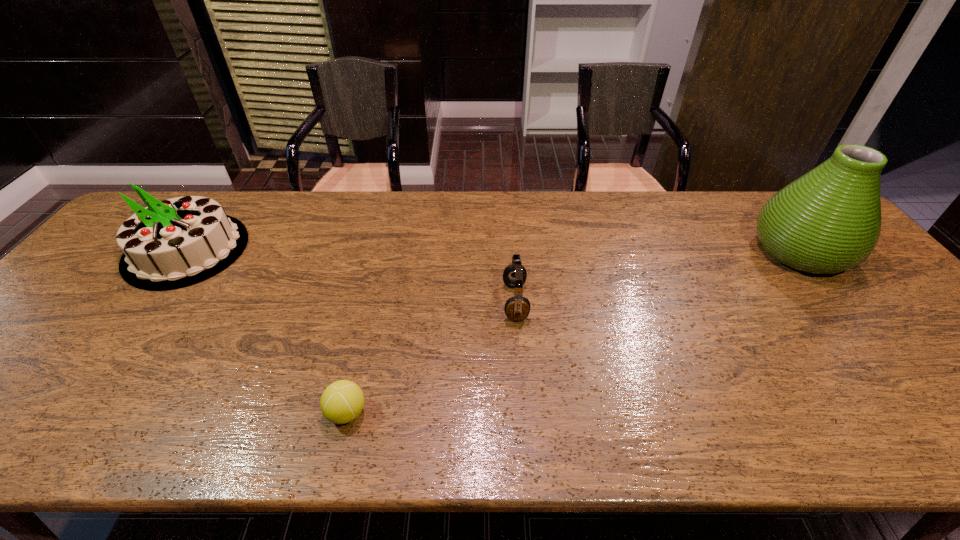
Locate an element on the screen. The width and height of the screenshot is (960, 540). the rightmost object is located at coordinates (827, 221).

I want to click on the tallest object, so click(x=827, y=221).

Find the location of a particular element. This screenshot has height=540, width=960. birthday cake is located at coordinates [x=175, y=243].

Where is `the leftmost object`? This screenshot has height=540, width=960. the leftmost object is located at coordinates (175, 243).

At what (x,y) coordinates should I click in order to perform the action: click on the third tallest object. Please return your answer as a coordinate pair (x, y). Image resolution: width=960 pixels, height=540 pixels. Looking at the image, I should click on (517, 308).

At what (x,y) coordinates should I click in order to perform the action: click on headset. Please return your answer as a coordinate pair (x, y). The image size is (960, 540). Looking at the image, I should click on (517, 308).

The image size is (960, 540). What are the coordinates of `the third object from right to left` in the screenshot? It's located at 341,402.

Identify the location of tennis ball. (341, 402).

Locate an element on the screen. The height and width of the screenshot is (540, 960). vacant area situated on the left of the vase is located at coordinates (684, 251).

I want to click on vacant space located on the back of the leftmost object, so click(220, 205).